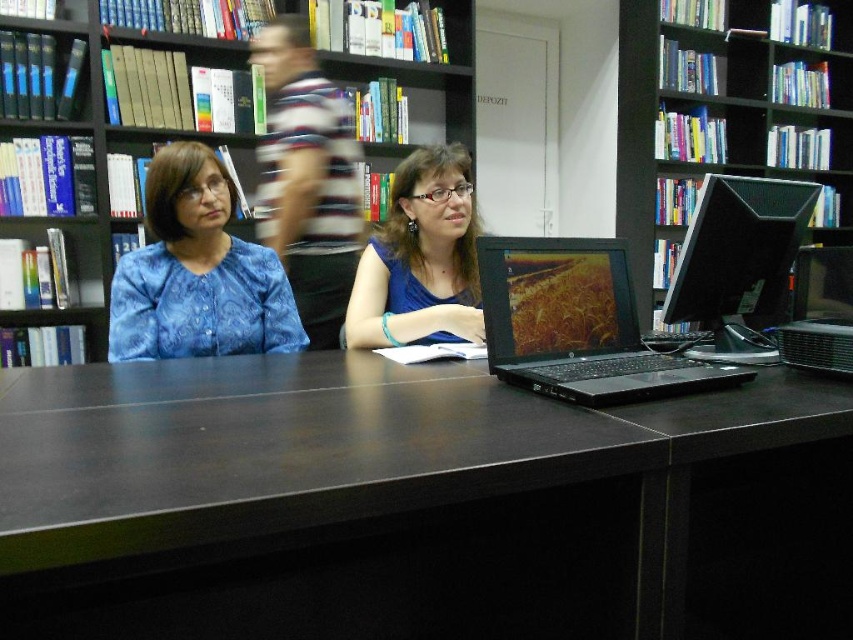
Is blue fabric shirt at center to the left of black glossy monitor at right from the viewer's perspective?

Indeed, blue fabric shirt at center is positioned on the left side of black glossy monitor at right.

Who is taller, blue fabric shirt at center or black glossy monitor at right?

blue fabric shirt at center is taller.

This screenshot has width=853, height=640. What do you see at coordinates (421, 259) in the screenshot?
I see `blue fabric shirt at center` at bounding box center [421, 259].

Where is `blue fabric shirt at center`? Image resolution: width=853 pixels, height=640 pixels. blue fabric shirt at center is located at coordinates (421, 259).

In the scene shown: Can you confirm if wooden bookshelf at center is positioned to the left of striped fabric shirt at upper center?

Yes, wooden bookshelf at center is to the left of striped fabric shirt at upper center.

Can you confirm if wooden bookshelf at center is positioned to the right of striped fabric shirt at upper center?

No, wooden bookshelf at center is not to the right of striped fabric shirt at upper center.

Is point (86, 328) less distant than point (291, 164)?

No, (86, 328) is behind (291, 164).

This screenshot has width=853, height=640. I want to click on wooden bookshelf at center, so click(109, 148).

Between wooden bookshelf at center and black matte laptop at center, which one is positioned higher?

wooden bookshelf at center is above.

Is point (103, 282) positioned after point (619, 332)?

Yes, it is behind point (619, 332).

At what (x,y) coordinates should I click in order to perform the action: click on wooden bookshelf at center. Please return your answer as a coordinate pair (x, y). The image size is (853, 640). Looking at the image, I should click on (109, 148).

You are a GUI agent. You are given a task and a screenshot of the screen. Output one action in this format:
    pyautogui.click(x=<x>, y=<y>)
    Task: Click on the wooden bookshelf at center
    The image size is (853, 640).
    Given the screenshot: What is the action you would take?
    pyautogui.click(x=109, y=148)